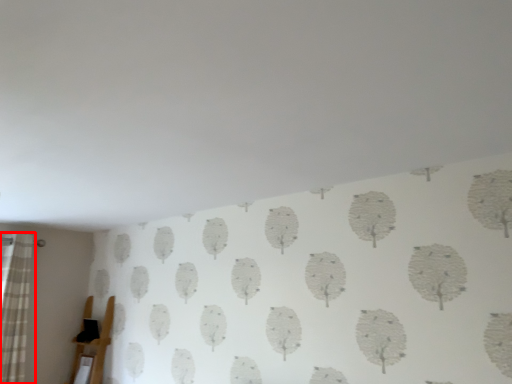
Question: From the image's perspective, what is the correct spatial relationship of curtain (annotated by the red box) in relation to furniture?

Choices:
 (A) above
 (B) below

Answer: (A)